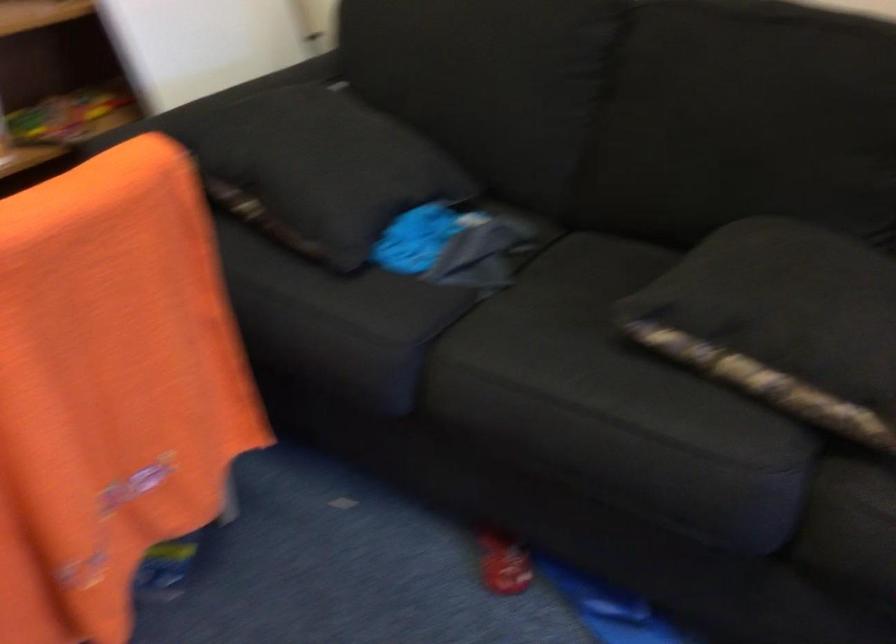
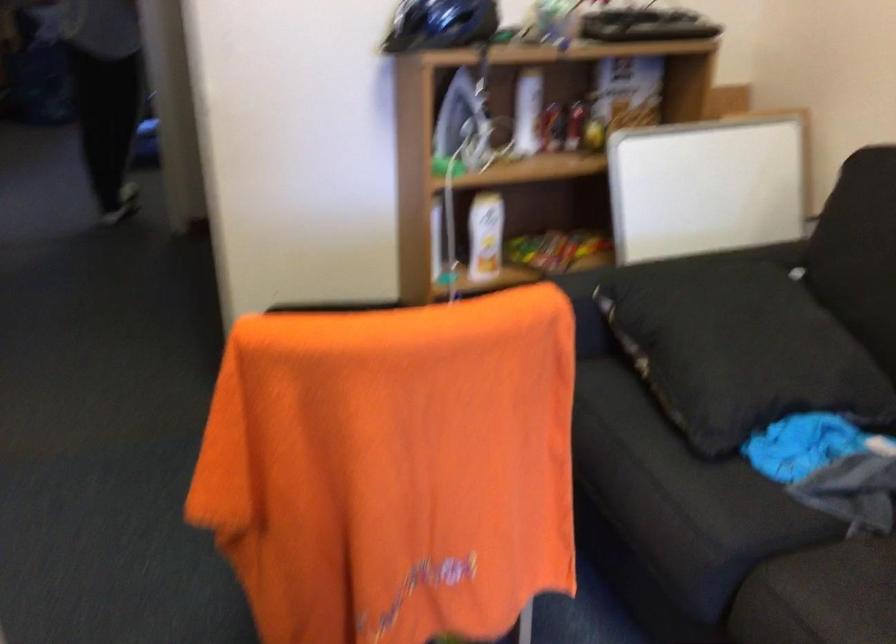
Question: The camera is either moving clockwise (left) or counter-clockwise (right) around the object. The first image is from the beginning of the video and the second image is from the end. Is the camera moving left or right when shooting the video?

Choices:
 (A) Left
 (B) Right

Answer: (B)